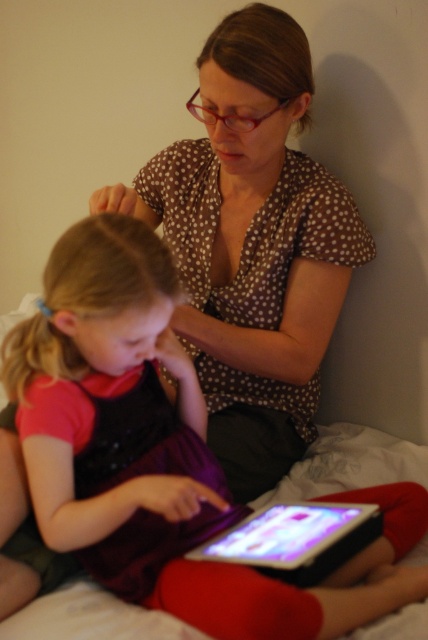
Question: Does matte purple dress at center have a smaller size compared to black glossy tablet at lower center?

Choices:
 (A) yes
 (B) no

Answer: (B)

Question: Is matte purple dress at center positioned in front of black glossy tablet at lower center?

Choices:
 (A) yes
 (B) no

Answer: (A)

Question: Which object appears farthest from the camera in this image?

Choices:
 (A) black glossy tablet at lower center
 (B) brown dotted blouse at upper center
 (C) matte purple dress at center

Answer: (B)

Question: Based on their relative distances, which object is farther from the brown dotted blouse at upper center?

Choices:
 (A) black glossy tablet at lower center
 (B) matte purple dress at center

Answer: (A)

Question: Which point is closer to the camera taking this photo?

Choices:
 (A) (294, 554)
 (B) (300, 260)
 (C) (183, 500)

Answer: (A)

Question: Does brown dotted blouse at upper center come behind black glossy tablet at lower center?

Choices:
 (A) yes
 (B) no

Answer: (A)